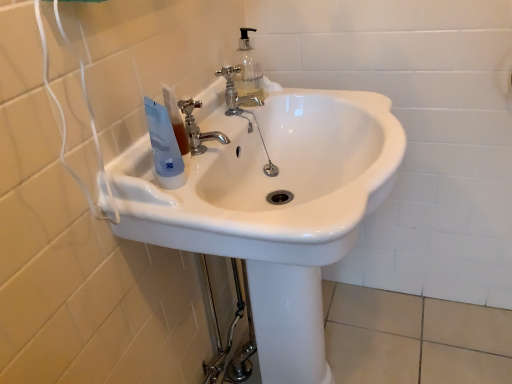
How much space does chrome metallic faucet at center, acting as the second tap starting from the right, occupy horizontally?

The width of chrome metallic faucet at center, acting as the second tap starting from the right, is 1.92 inches.

What do you see at coordinates (176, 119) in the screenshot?
I see `white plastic bottle at upper left` at bounding box center [176, 119].

Locate an element on the screen. Image resolution: width=512 pixels, height=384 pixels. blue plastic tube at upper left is located at coordinates (164, 147).

Can you tell me how much white glossy sink at center and white plastic bottle at upper left differ in facing direction?

The angular difference between white glossy sink at center and white plastic bottle at upper left is 3.69 degrees.

Considering the points (329, 382) and (172, 124), which point is behind, point (329, 382) or point (172, 124)?

The point (329, 382) is farther from the camera.

Is the position of white glossy sink at center less distant than that of white plastic bottle at upper left?

Yes.

Considering the positions of objects chrome metallic faucet at upper center, positioned as the 2th tap in front-to-back order, and chrome metallic faucet at center, which ranks as the second tap in back-to-front order, in the image provided, who is more to the left, chrome metallic faucet at upper center, positioned as the 2th tap in front-to-back order, or chrome metallic faucet at center, which ranks as the second tap in back-to-front order,?

Positioned to the left is chrome metallic faucet at center, which ranks as the second tap in back-to-front order.

Between chrome metallic faucet at upper center, the second tap in the left-to-right sequence, and chrome metallic faucet at center, acting as the second tap starting from the top, which one has less height?

chrome metallic faucet at upper center, the second tap in the left-to-right sequence.

Is point (234, 81) closer to camera compared to point (192, 150)?

No, (234, 81) is behind (192, 150).

From a real-world perspective, which is physically above, chrome metallic faucet at upper center, the 2th tap in the bottom-to-top sequence, or chrome metallic faucet at center, acting as the second tap starting from the top?

In real-world perspective, chrome metallic faucet at center, acting as the second tap starting from the top, is above.

Does white plastic bottle at upper left turn towards white glossy sink at center?

Yes, white plastic bottle at upper left is aimed at white glossy sink at center.

Relative to white glossy sink at center, is white plastic bottle at upper left in front or behind?

In the image, white plastic bottle at upper left appears behind white glossy sink at center.

Considering the sizes of objects white plastic bottle at upper left and white glossy sink at center in the image provided, who is taller, white plastic bottle at upper left or white glossy sink at center?

white glossy sink at center.

Can you confirm if white glossy sink at center is thinner than blue plastic tube at upper left?

No, white glossy sink at center is not thinner than blue plastic tube at upper left.

Can you confirm if white glossy sink at center is shorter than blue plastic tube at upper left?

In fact, white glossy sink at center may be taller than blue plastic tube at upper left.

In the scene shown: In the image, is white glossy sink at center on the left side or the right side of blue plastic tube at upper left?

In the image, white glossy sink at center appears on the right side of blue plastic tube at upper left.

Which object is wider, blue plastic tube at upper left or white glossy sink at center?

white glossy sink at center is wider.

Could you tell me if blue plastic tube at upper left is turned towards white glossy sink at center?

No.

Is blue plastic tube at upper left further to the viewer compared to white glossy sink at center?

Yes, blue plastic tube at upper left is further from the camera.

At what (x,y) coordinates should I click in order to perform the action: click on mouthwash above the white glossy sink at center (from a real-world perspective). Please return your answer as a coordinate pair (x, y). This screenshot has width=512, height=384. Looking at the image, I should click on [164, 147].

Can you confirm if blue plastic tube at upper left is positioned to the left of white plastic bottle at upper left?

Yes, blue plastic tube at upper left is to the left of white plastic bottle at upper left.

Looking at this image, is blue plastic tube at upper left aimed at white plastic bottle at upper left?

No, blue plastic tube at upper left is not aimed at white plastic bottle at upper left.

Is the position of blue plastic tube at upper left less distant than that of white plastic bottle at upper left?

Yes, the depth of blue plastic tube at upper left is less than that of white plastic bottle at upper left.

How many degrees apart are the facing directions of blue plastic tube at upper left and white plastic bottle at upper left?

3.69 degrees separate the facing orientations of blue plastic tube at upper left and white plastic bottle at upper left.

Between white glossy sink at center and chrome metallic faucet at center, which ranks as the second tap in back-to-front order, which one has smaller width?

With smaller width is chrome metallic faucet at center, which ranks as the second tap in back-to-front order.

From a real-world perspective, is white glossy sink at center physically above chrome metallic faucet at center, which is the first tap from front to back?

Incorrect, from a real-world perspective, white glossy sink at center is lower than chrome metallic faucet at center, which is the first tap from front to back.

From their relative heights in the image, would you say white glossy sink at center is taller or shorter than chrome metallic faucet at center, placed as the first tap when sorted from bottom to top?

Clearly, white glossy sink at center is taller compared to chrome metallic faucet at center, placed as the first tap when sorted from bottom to top.

This screenshot has height=384, width=512. What are the coordinates of `toiletry on the left of white glossy sink at center` in the screenshot? It's located at (176, 119).

Where is `tap above the chrome metallic faucet at center, which ranks as the first tap in left-to-right order (from the image's perspective)`? The image size is (512, 384). tap above the chrome metallic faucet at center, which ranks as the first tap in left-to-right order (from the image's perspective) is located at coordinates (243, 87).

Considering their positions, is chrome metallic faucet at center, placed as the first tap when sorted from bottom to top, positioned closer to white glossy sink at center than chrome metallic faucet at upper center, positioned as the first tap in top-to-bottom order?

chrome metallic faucet at center, placed as the first tap when sorted from bottom to top.

Which object lies further to the anchor point chrome metallic faucet at upper center, positioned as the first tap in top-to-bottom order, blue plastic tube at upper left or chrome metallic faucet at center, which ranks as the first tap in left-to-right order?

blue plastic tube at upper left.

Which object lies nearer to the anchor point chrome metallic faucet at upper center, which appears as the 1th tap when viewed from the back, blue plastic tube at upper left or white plastic bottle at upper left?

white plastic bottle at upper left lies closer to chrome metallic faucet at upper center, which appears as the 1th tap when viewed from the back, than the other object.

Based on their spatial positions, is chrome metallic faucet at center, placed as the first tap when sorted from bottom to top, or chrome metallic faucet at upper center, positioned as the 2th tap in front-to-back order, further from blue plastic tube at upper left?

chrome metallic faucet at upper center, positioned as the 2th tap in front-to-back order, is positioned further to the anchor blue plastic tube at upper left.

Based on their spatial positions, is white glossy sink at center or blue plastic tube at upper left closer to chrome metallic faucet at center, which ranks as the first tap in left-to-right order?

blue plastic tube at upper left.

From the image, which object appears to be farther from blue plastic tube at upper left, white plastic bottle at upper left or chrome metallic faucet at center, acting as the second tap starting from the top?

chrome metallic faucet at center, acting as the second tap starting from the top.

Based on their spatial positions, is white plastic bottle at upper left or chrome metallic faucet at center, which is the first tap from front to back, further from chrome metallic faucet at upper center, positioned as the 2th tap in front-to-back order?

white plastic bottle at upper left is positioned further to the anchor chrome metallic faucet at upper center, positioned as the 2th tap in front-to-back order.

Estimate the real-world distances between objects in this image. Which object is closer to blue plastic tube at upper left, white glossy sink at center or chrome metallic faucet at center, placed as the first tap when sorted from bottom to top?

Based on the image, chrome metallic faucet at center, placed as the first tap when sorted from bottom to top, appears to be nearer to blue plastic tube at upper left.

Find the location of a particular element. toiletry that lies between chrome metallic faucet at upper center, positioned as the first tap in top-to-bottom order, and white glossy sink at center from top to bottom is located at coordinates 176,119.

I want to click on mouthwash that lies between chrome metallic faucet at center, acting as the second tap starting from the right, and white glossy sink at center from top to bottom, so click(x=164, y=147).

I want to click on mouthwash between white glossy sink at center and chrome metallic faucet at upper center, the second tap in the left-to-right sequence, from front to back, so click(164, 147).

Locate an element on the screen. The width and height of the screenshot is (512, 384). mouthwash between white plastic bottle at upper left and white glossy sink at center in the up-down direction is located at coordinates (164, 147).